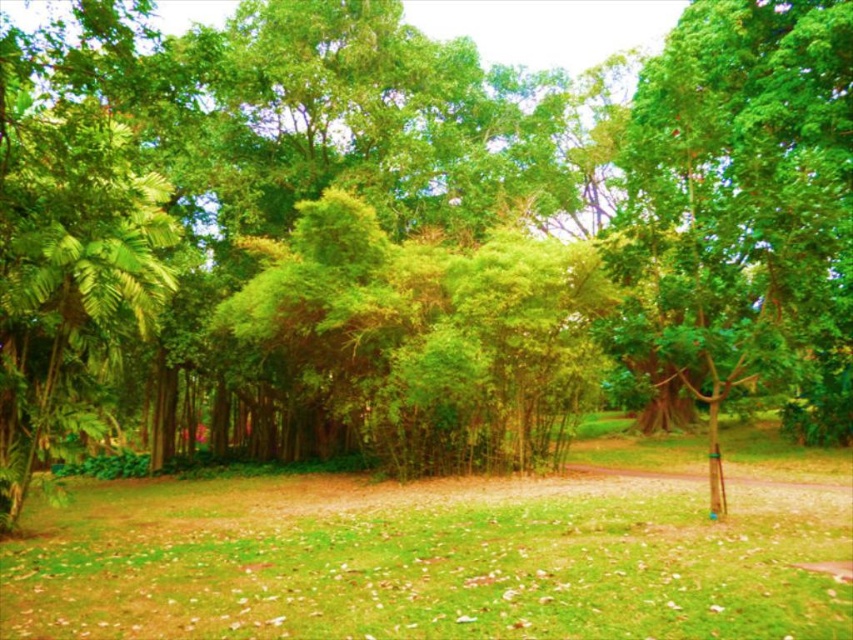
Question: Which of the following is the closest to the observer?

Choices:
 (A) green leafy tree at right
 (B) green grass at center

Answer: (B)

Question: Which of the following is the closest to the observer?

Choices:
 (A) (48, 582)
 (B) (708, 387)

Answer: (A)

Question: Can you confirm if green grass at center is wider than green leafy tree at right?

Choices:
 (A) no
 (B) yes

Answer: (B)

Question: Does green grass at center have a greater width compared to green leafy tree at right?

Choices:
 (A) yes
 (B) no

Answer: (A)

Question: Does green grass at center appear on the right side of green leafy tree at right?

Choices:
 (A) yes
 (B) no

Answer: (B)